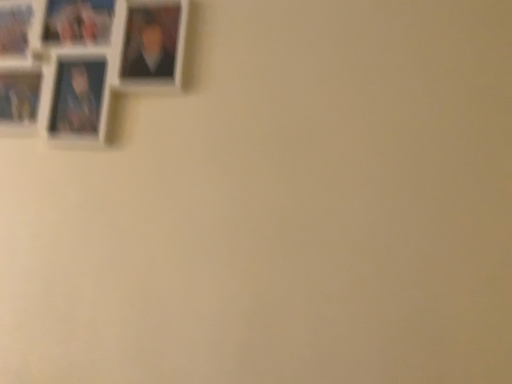
Question: Should I look upward or downward to see white plastic picture frame at upper left?

Choices:
 (A) up
 (B) down

Answer: (A)